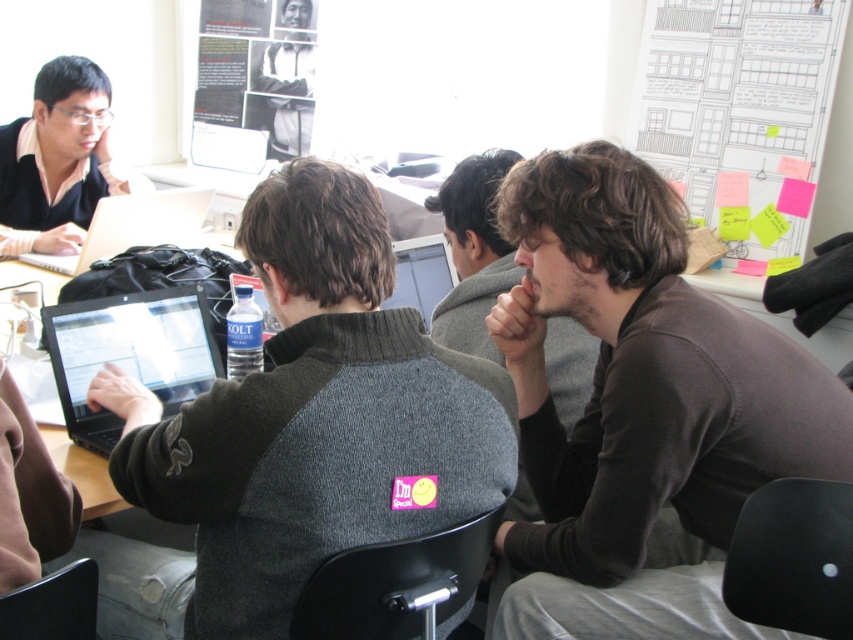
Does brown soft sweater at center have a lesser height compared to brown fuzzy sweater at center?

No.

Between point (529, 390) and point (483, 179), which one is positioned behind?

The point (483, 179) is more distant.

Image resolution: width=853 pixels, height=640 pixels. Find the location of `brown soft sweater at center`. brown soft sweater at center is located at coordinates (640, 410).

Does matte black laptop at upper left have a lesser height compared to silver metallic laptop at left?

No, matte black laptop at upper left is not shorter than silver metallic laptop at left.

Does point (20, 148) come in front of point (78, 257)?

No, it is not.

Find the location of a particular element. matte black laptop at upper left is located at coordinates (56, 161).

Is brown soft sweater at center below silver metallic laptop at left?

Indeed, brown soft sweater at center is positioned under silver metallic laptop at left.

Can you confirm if brown soft sweater at center is bigger than silver metallic laptop at left?

Yes.

The image size is (853, 640). Identify the location of brown soft sweater at center. (640, 410).